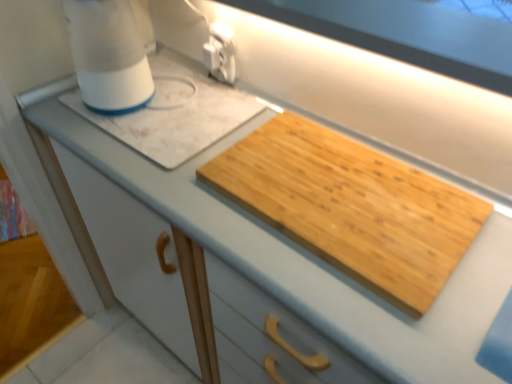
You are a GUI agent. You are given a task and a screenshot of the screen. Output one action in this format:
    pyautogui.click(x=<x>, y=<y>)
    Task: Click on the natural wood cutting board at center
    This screenshot has width=512, height=384.
    Given the screenshot: What is the action you would take?
    pos(351,207)

Measure the distance between point (x=338, y=241) and camera.

Point (x=338, y=241) and camera are 25.67 inches apart from each other.

Locate an element on the screen. Image resolution: width=512 pixels, height=384 pixels. natural wood cutting board at center is located at coordinates click(x=351, y=207).

You are a GUI agent. You are given a task and a screenshot of the screen. Output one action in this format:
    pyautogui.click(x=<x>, y=<y>)
    Task: Click on the cutting board in front of the white plastic electric outlet at upper center
    
    Given the screenshot: What is the action you would take?
    pyautogui.click(x=351, y=207)

Is white plastic electric outlet at upper center placed right next to natural wood cutting board at center?

No, white plastic electric outlet at upper center is not touching natural wood cutting board at center.

Considering the relative sizes of white plastic electric outlet at upper center and natural wood cutting board at center in the image provided, is white plastic electric outlet at upper center smaller than natural wood cutting board at center?

Yes, white plastic electric outlet at upper center is smaller than natural wood cutting board at center.

Between white plastic electric outlet at upper center and natural wood cutting board at center, which one appears on the left side from the viewer's perspective?

From the viewer's perspective, white plastic electric outlet at upper center appears more on the left side.

Considering the sizes of objects white plastic blender at upper left and white plastic electric outlet at upper center in the image provided, who is bigger, white plastic blender at upper left or white plastic electric outlet at upper center?

Bigger between the two is white plastic blender at upper left.

Is the depth of white plastic blender at upper left less than that of white plastic electric outlet at upper center?

That is True.

Can you confirm if white plastic blender at upper left is positioned to the left of white plastic electric outlet at upper center?

Yes, white plastic blender at upper left is to the left of white plastic electric outlet at upper center.

Which point is more distant from viewer, (77, 5) or (216, 35)?

Positioned behind is point (216, 35).

Can you confirm if white plastic blender at upper left is positioned to the left of natural wood cutting board at center?

Yes, white plastic blender at upper left is to the left of natural wood cutting board at center.

Is white plastic blender at upper left facing towards natural wood cutting board at center?

No, white plastic blender at upper left does not turn towards natural wood cutting board at center.

Is the surface of white plastic blender at upper left in direct contact with natural wood cutting board at center?

No, white plastic blender at upper left is not with natural wood cutting board at center.

Between white plastic blender at upper left and natural wood cutting board at center, which one has smaller width?

Thinner between the two is white plastic blender at upper left.

Would you say natural wood cutting board at center is to the left or to the right of white plastic blender at upper left in the picture?

natural wood cutting board at center is to the right of white plastic blender at upper left.

From a real-world perspective, is natural wood cutting board at center above or below white plastic blender at upper left?

natural wood cutting board at center is below white plastic blender at upper left.

Is point (243, 182) positioned before point (100, 73)?

Yes, it is in front of point (100, 73).

Can you see natural wood cutting board at center touching white plastic blender at upper left?

No, natural wood cutting board at center is not touching white plastic blender at upper left.

In the image, is white plastic electric outlet at upper center positioned in front of or behind white plastic blender at upper left?

white plastic electric outlet at upper center is positioned farther from the viewer than white plastic blender at upper left.

Is white plastic electric outlet at upper center far from white plastic blender at upper left?

→ That's not correct — white plastic electric outlet at upper center is a little close to white plastic blender at upper left.

Considering the relative sizes of white plastic electric outlet at upper center and white plastic blender at upper left in the image provided, is white plastic electric outlet at upper center taller than white plastic blender at upper left?

Incorrect, the height of white plastic electric outlet at upper center is not larger of that of white plastic blender at upper left.

Which object is positioned more to the left, white plastic electric outlet at upper center or white plastic blender at upper left?

white plastic blender at upper left is more to the left.

Between natural wood cutting board at center and white plastic electric outlet at upper center, which one has more height?

white plastic electric outlet at upper center.

Is natural wood cutting board at center positioned before white plastic electric outlet at upper center?

Yes, natural wood cutting board at center is closer to the camera.

Considering the positions of points (399, 232) and (211, 60), is point (399, 232) farther from camera compared to point (211, 60)?

No.

You are a GUI agent. You are given a task and a screenshot of the screen. Output one action in this format:
    pyautogui.click(x=<x>, y=<y>)
    Task: Click on the electric outlet located above the natural wood cutting board at center (from a real-world perspective)
    The image size is (512, 384).
    Given the screenshot: What is the action you would take?
    pyautogui.click(x=220, y=53)

Identify the location of electric outlet located on the right of white plastic blender at upper left. The height and width of the screenshot is (384, 512). (220, 53).

From the image, which object appears to be farther from natural wood cutting board at center, white plastic blender at upper left or white plastic electric outlet at upper center?

The object further to natural wood cutting board at center is white plastic blender at upper left.

In the scene shown: When comparing their distances from white plastic electric outlet at upper center, does white plastic blender at upper left or natural wood cutting board at center seem closer?

white plastic blender at upper left lies closer to white plastic electric outlet at upper center than the other object.

When comparing their distances from natural wood cutting board at center, does white plastic electric outlet at upper center or white plastic blender at upper left seem further?

white plastic blender at upper left lies further to natural wood cutting board at center than the other object.

Estimate the real-world distances between objects in this image. Which object is closer to white plastic blender at upper left, white plastic electric outlet at upper center or natural wood cutting board at center?

white plastic electric outlet at upper center is closer to white plastic blender at upper left.

From the image, which object appears to be nearer to white plastic electric outlet at upper center, natural wood cutting board at center or white plastic blender at upper left?

Among the two, white plastic blender at upper left is located nearer to white plastic electric outlet at upper center.

When comparing their distances from white plastic blender at upper left, does natural wood cutting board at center or white plastic electric outlet at upper center seem further?

Among the two, natural wood cutting board at center is located further to white plastic blender at upper left.

What are the coordinates of `electric outlet between white plastic blender at upper left and natural wood cutting board at center` in the screenshot? It's located at (220, 53).